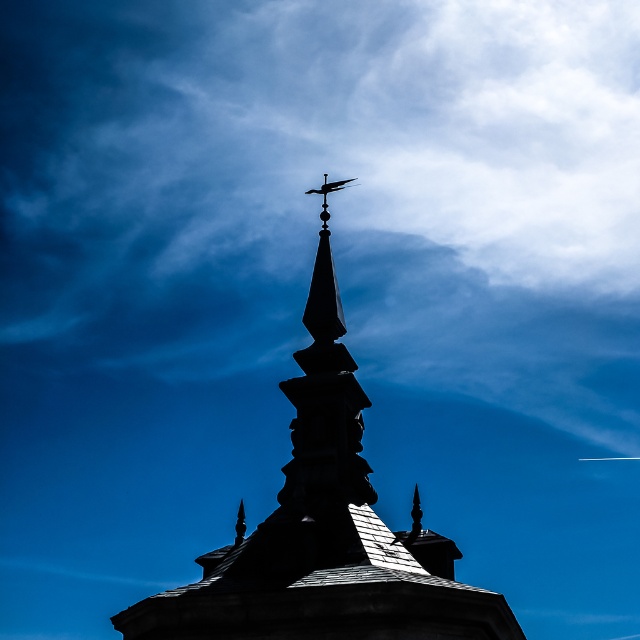
Question: Is blue sky at upper center bigger than black matte weather vane at upper center?

Choices:
 (A) yes
 (B) no

Answer: (A)

Question: Based on their relative distances, which object is nearer to the silhouette stone tower at center?

Choices:
 (A) black matte weather vane at upper center
 (B) blue sky at upper center

Answer: (A)

Question: Estimate the real-world distances between objects in this image. Which object is farther from the silhouette stone tower at center?

Choices:
 (A) black matte weather vane at upper center
 (B) blue sky at upper center

Answer: (B)

Question: Which point is closer to the camera?

Choices:
 (A) silhouette stone tower at center
 (B) black matte weather vane at upper center

Answer: (A)

Question: Considering the relative positions of silhouette stone tower at center and black matte weather vane at upper center in the image provided, where is silhouette stone tower at center located with respect to black matte weather vane at upper center?

Choices:
 (A) right
 (B) left

Answer: (B)

Question: Can you confirm if blue sky at upper center is positioned to the left of silhouette stone tower at center?

Choices:
 (A) yes
 (B) no

Answer: (B)